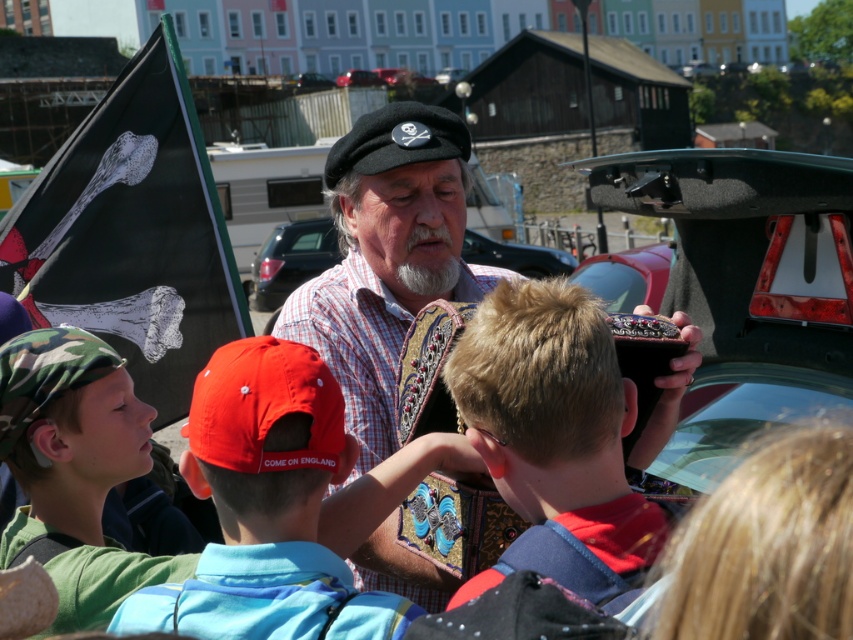
Does plaid shirt at center come in front of metallic car trunk at center?

Yes, it is in front of metallic car trunk at center.

Consider the image. Who is more forward, (325,179) or (289,237)?

Point (325,179)

I want to click on plaid shirt at center, so click(x=387, y=257).

Can you confirm if red fabric cap at center is thinner than metallic car trunk at center?

Yes.

Is point (267, 368) positioned before point (267, 241)?

Yes, it is.

Image resolution: width=853 pixels, height=640 pixels. Find the location of `red fabric cap at center`. red fabric cap at center is located at coordinates (265, 508).

Which is in front, point (141, 310) or point (490, 406)?

Point (490, 406) is in front.

Does black fabric flag at left lie in front of blonde hair boy at center?

No, it is behind blonde hair boy at center.

What do you see at coordinates (132, 234) in the screenshot?
I see `black fabric flag at left` at bounding box center [132, 234].

In order to click on black fabric flag at left in this screenshot , I will do `click(132, 234)`.